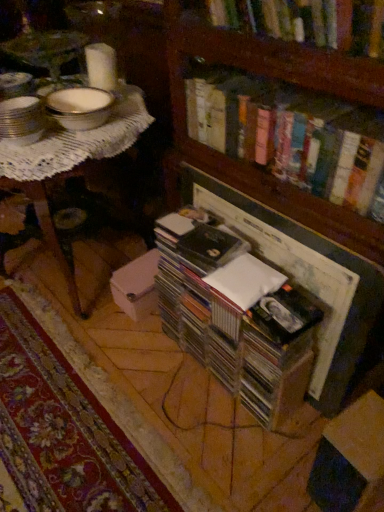
The width and height of the screenshot is (384, 512). I want to click on empty space that is ontop of hardcover books at upper center, marked as the 2th book in a bottom-to-top arrangement, so click(x=307, y=97).